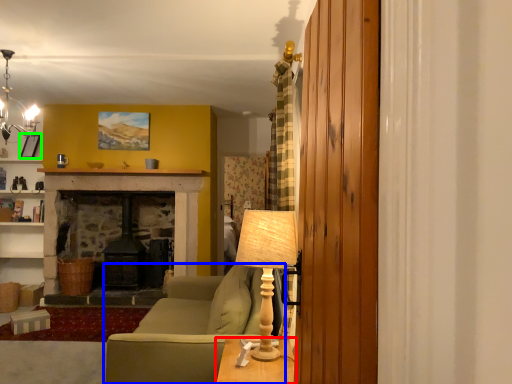
Question: Which object is the farthest from table (highlighted by a red box)? Choose among these: studio couch (highlighted by a blue box) or picture frame (highlighted by a green box).

Choices:
 (A) studio couch
 (B) picture frame

Answer: (B)